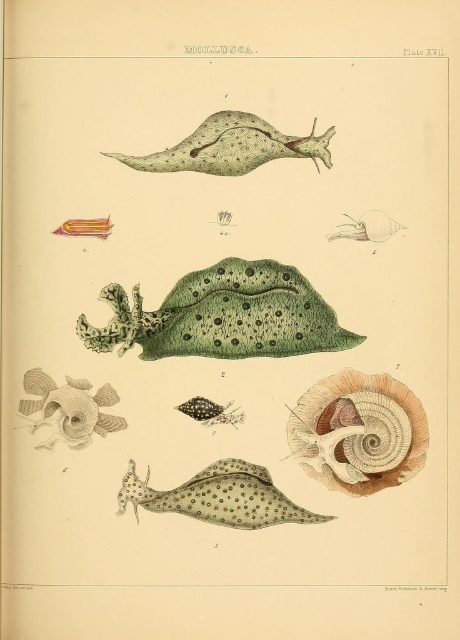
Looking at this image, is speckled green slug at center positioned before brown textured shell at center?

Answer: Yes, it is.

Is speckled green slug at center to the right of brown textured shell at center from the viewer's perspective?

Correct, you'll find speckled green slug at center to the right of brown textured shell at center.

Find the location of a particular element. The height and width of the screenshot is (640, 460). speckled green slug at center is located at coordinates (218, 497).

Between green matte slug at center and smooth brown shell at center, which one is positioned lower?

smooth brown shell at center is below.

Does green matte slug at center have a greater height compared to smooth brown shell at center?

In fact, green matte slug at center may be shorter than smooth brown shell at center.

You are a GUI agent. You are given a task and a screenshot of the screen. Output one action in this format:
    pyautogui.click(x=<x>, y=<y>)
    Task: Click on the green matte slug at center
    The width and height of the screenshot is (460, 640).
    Given the screenshot: What is the action you would take?
    pyautogui.click(x=224, y=316)

Between green matte slug at center and speckled green slug at center, which one is positioned higher?

green matte slug at center is higher up.

Does point (231, 289) come in front of point (281, 493)?

No.

The image size is (460, 640). Identify the location of green matte slug at center. (224, 316).